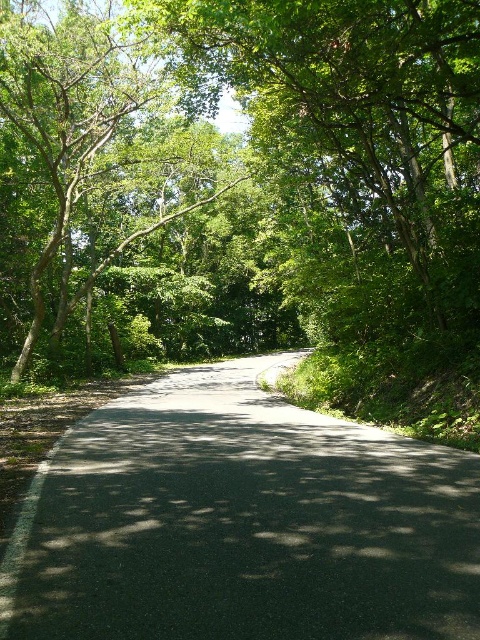
You are a cyclist riding on the black asphalt road at center. You notice a green leafy tree at upper left in your view. Which direction should you turn to face the tree?

The black asphalt road at center is to the right of the green leafy tree at upper left, so you should turn to your left to face the green leafy tree at upper left.

In the scene shown: You are a cyclist planning to ride along the black asphalt road at center. Considering the space occupied by the green leafy tree at upper left, do you think there is enough room for you to safely ride through the road without hitting the tree?

The black asphalt road at center occupies less space than the green leafy tree at upper left, so there might not be enough room for safe passage. The tree takes up more area, potentially encroaching on the road space. Proceed with caution and check the actual clearance before riding.